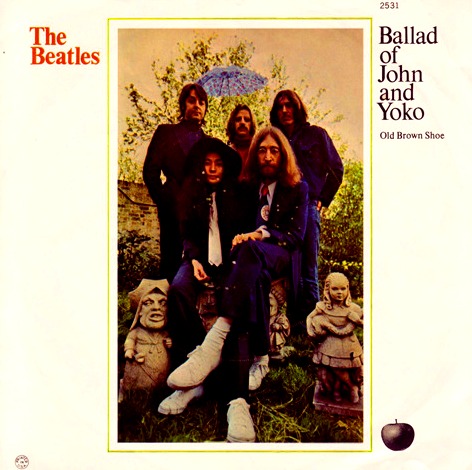
I want to click on statuary, so click(142, 345), click(334, 311), click(275, 310).